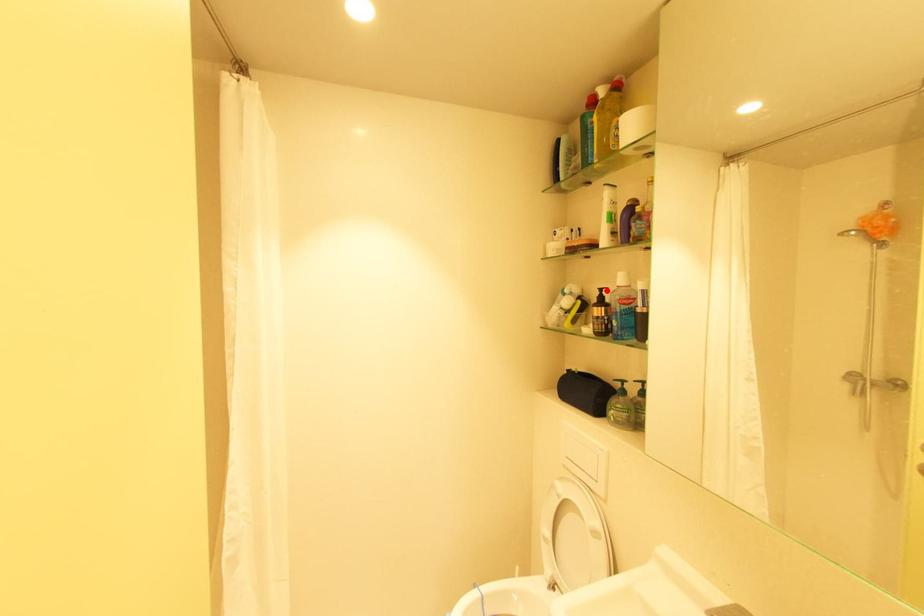
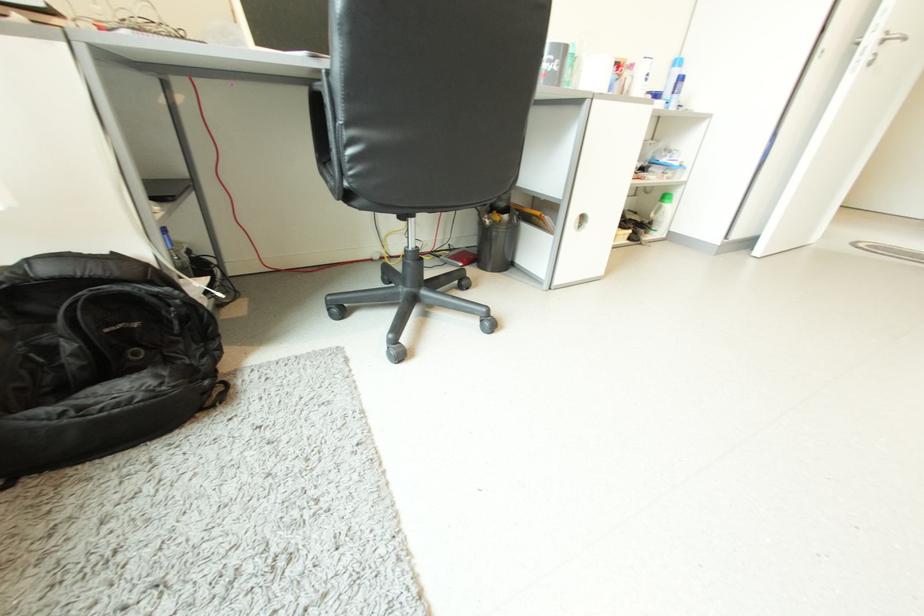
Question: I am providing you with two images of the same scene from different viewpoints. A red point is marked on the first image. Can you still see the location of the red point in image 2?

Choices:
 (A) Yes
 (B) No

Answer: (B)